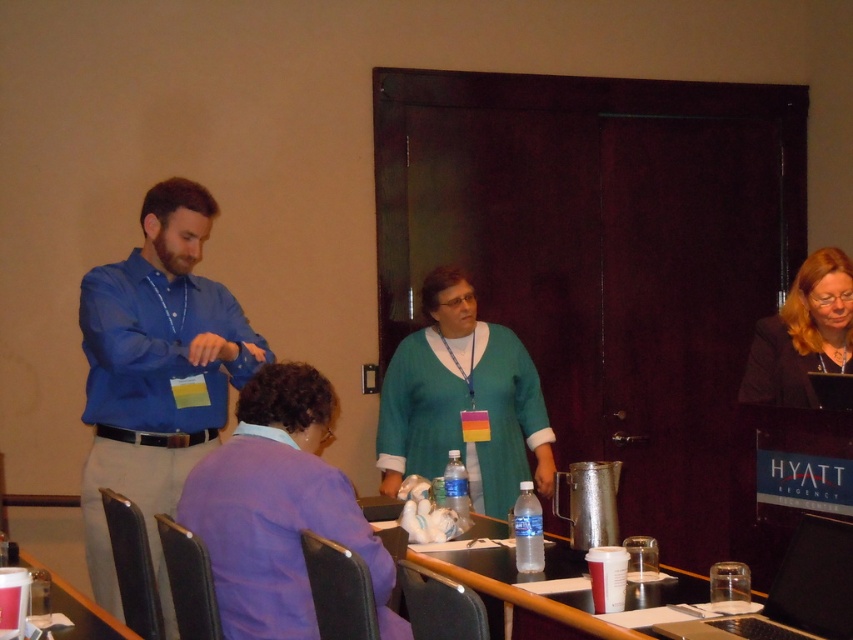
You are organizing a photo shoot and need to ensure that all participants are visible in the frame. Given that the purple matte shirt at lower left and the black plastic laptop at lower right are in the shot, which object takes up more horizontal space in the image?

The purple matte shirt at lower left takes up more horizontal space than the black plastic laptop at lower right because its width is larger than the laptop.

You are a photographer positioned to the right of the scene. You want to take a photo that includes both the purple matte shirt at lower left and the smooth plastic table at lower left. Which object should you adjust your camera angle to prioritize capturing first?

The purple matte shirt at lower left is to the right of the smooth plastic table at lower left, so you should prioritize capturing the smooth plastic table at lower left first since it is positioned further to the left and closer to your current angle on the right side of the scene.